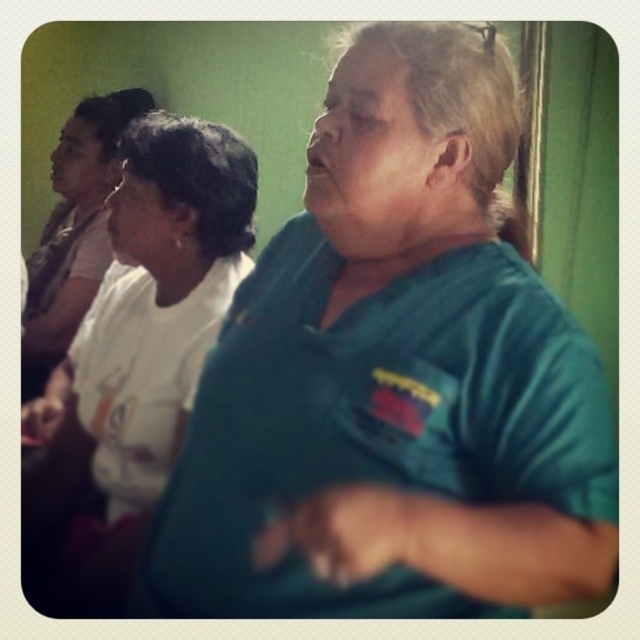
Which of these two, teal fabric shirt at center or white matte shirt at upper left, stands shorter?

teal fabric shirt at center

Which is below, teal fabric shirt at center or white matte shirt at upper left?

teal fabric shirt at center

Where is `teal fabric shirt at center`? This screenshot has width=640, height=640. teal fabric shirt at center is located at coordinates (394, 378).